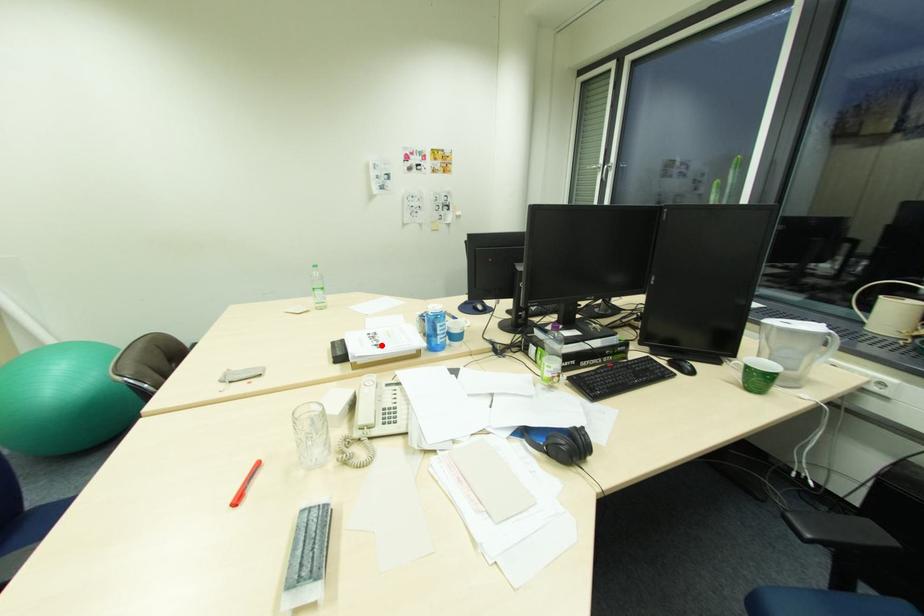
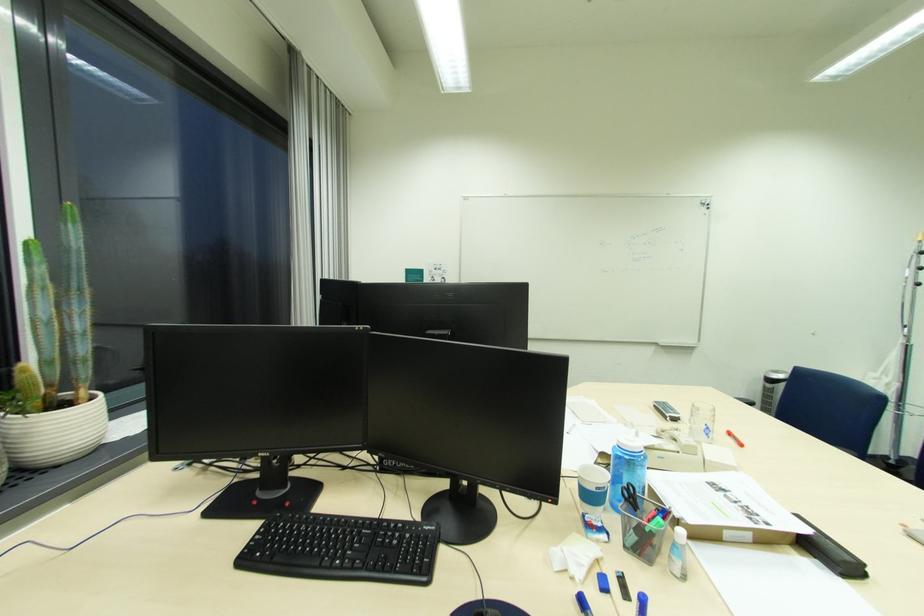
The point at the highlighted location is marked in the first image. Where is the corresponding point in the second image?

(731, 491)